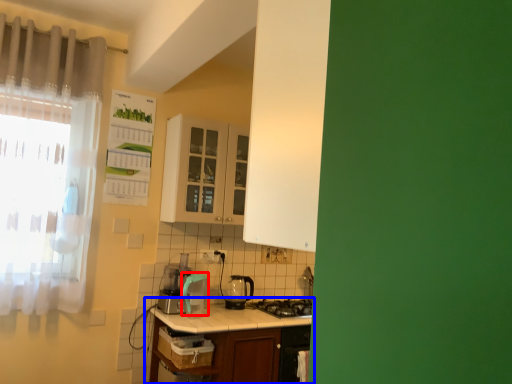
Question: Among these objects, which one is nearest to the camera, appliance (highlighted by a red box) or table (highlighted by a blue box)?

Choices:
 (A) appliance
 (B) table

Answer: (B)